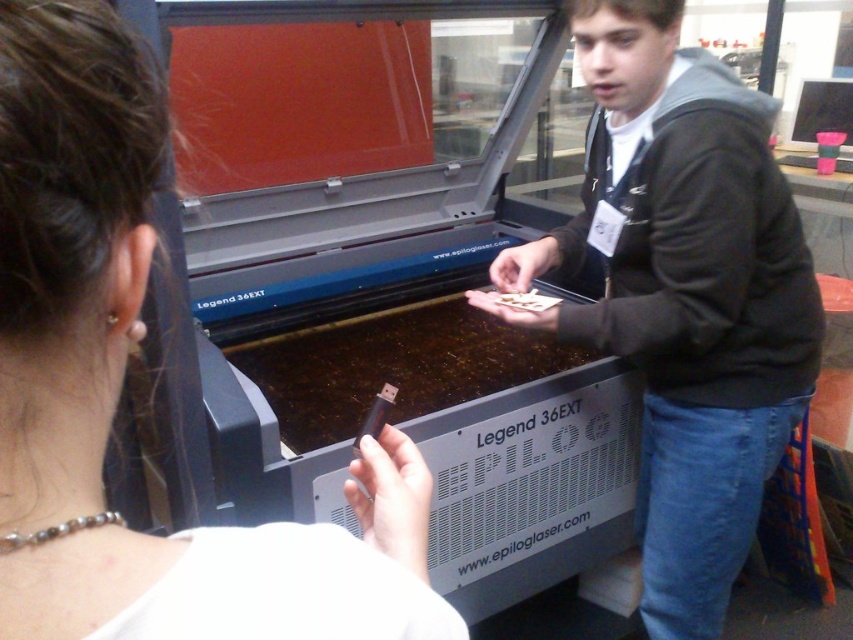
You are standing in front of the laser engraving machine and notice two points marked in the scene. Which of these points, point (x=254, y=620) or point (x=805, y=388), is closer to you?

Point (x=254, y=620) is closer to the viewer than point (x=805, y=388).

You are a technician who needs to retrieve the matte black usb drive at center from under the dark gray hoodie at center. Can you easily access it without moving the hoodie?

The matte black usb drive at center is positioned under dark gray hoodie at center, so you would need to move the hoodie to access it.